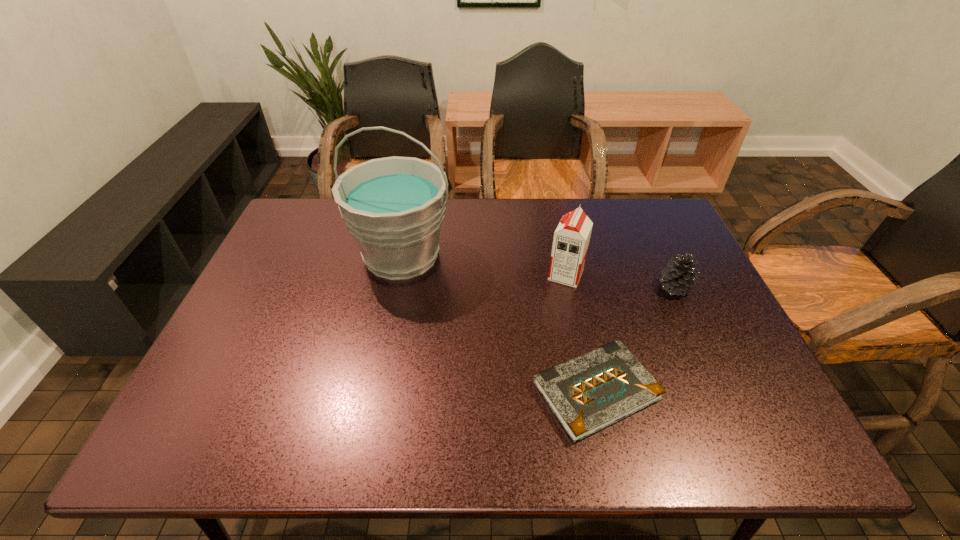
Locate an element on the screen. This screenshot has height=540, width=960. the leftmost object is located at coordinates (394, 206).

Locate an element on the screen. bucket is located at coordinates click(x=394, y=206).

You are a GUI agent. You are given a task and a screenshot of the screen. Output one action in this format:
    pyautogui.click(x=<x>, y=<y>)
    Task: Click on the soya milk
    
    Given the screenshot: What is the action you would take?
    tap(571, 239)

In order to click on the rightmost object in this screenshot , I will do `click(678, 278)`.

At what (x,y) coordinates should I click in order to perform the action: click on pinecone. Please return your answer as a coordinate pair (x, y). This screenshot has height=540, width=960. Looking at the image, I should click on (678, 278).

This screenshot has height=540, width=960. I want to click on the nearest object, so click(587, 394).

Locate an element on the screen. The width and height of the screenshot is (960, 540). notebook is located at coordinates point(587,394).

Find the location of a particular element. The height and width of the screenshot is (540, 960). free location located on the back of the bucket is located at coordinates (x=413, y=201).

Where is `vacant space located 0.270m on the right of the soya milk`? vacant space located 0.270m on the right of the soya milk is located at coordinates (682, 275).

Locate an element on the screen. The image size is (960, 540). vacant space situated on the back of the rightmost object is located at coordinates (637, 207).